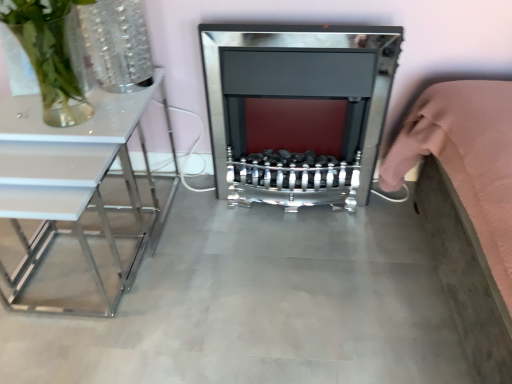
The image size is (512, 384). Describe the element at coordinates (259, 305) in the screenshot. I see `concretesmoothfloor at center` at that location.

Consider the image. In order to face concretesmoothfloor at center, should I rotate leftwards or rightwards?

To align with it, rotate left about 7.653°.

This screenshot has width=512, height=384. What do you see at coordinates (72, 182) in the screenshot? I see `white glossy table at left` at bounding box center [72, 182].

Measure the distance between clear glass vase at upper left and camera.

clear glass vase at upper left is 1.05 meters from camera.

Measure the distance between pink fabric bed at right and camera.

pink fabric bed at right and camera are 71.92 centimeters apart.

Locate an element on the screen. The width and height of the screenshot is (512, 384). pink fabric bed at right is located at coordinates (466, 159).

This screenshot has height=384, width=512. Identify the location of concretesmoothfloor at center. (259, 305).

Based on the photo, between white glossy table at left and clear glass vase at upper left, which one appears on the left side from the viewer's perspective?

white glossy table at left is more to the left.

Does white glossy table at left turn towards clear glass vase at upper left?

No, white glossy table at left is not oriented towards clear glass vase at upper left.

From their relative heights in the image, would you say white glossy table at left is taller or shorter than clear glass vase at upper left?

white glossy table at left is taller than clear glass vase at upper left.

At what (x,y) coordinates should I click in order to perform the action: click on table that appears below the clear glass vase at upper left (from a real-world perspective). Please return your answer as a coordinate pair (x, y). Looking at the image, I should click on pos(72,182).

Do you think pink fabric bed at right is within polished chrome fireplace at center, or outside of it?

pink fabric bed at right is outside polished chrome fireplace at center.

Based on the photo, considering the sizes of objects pink fabric bed at right and polished chrome fireplace at center in the image provided, who is bigger, pink fabric bed at right or polished chrome fireplace at center?

pink fabric bed at right.

The image size is (512, 384). Identify the location of bed that appears below the polished chrome fireplace at center (from the image's perspective). (466, 159).

From the picture: From a real-world perspective, is polished chrome fireplace at center above or below clear glass vase at upper left?

Clearly, from a real-world perspective, polished chrome fireplace at center is below clear glass vase at upper left.

Is polished chrome fireplace at center taller than clear glass vase at upper left?

Correct, polished chrome fireplace at center is much taller as clear glass vase at upper left.

Measure the distance from polished chrome fireplace at center to clear glass vase at upper left.

They are 16.02 inches apart.

Is polished chrome fireplace at center placed right next to clear glass vase at upper left?

polished chrome fireplace at center and clear glass vase at upper left are clearly separated.

Is pink fabric bed at right positioned with its back to white glossy table at left?

No, white glossy table at left is not at the back of pink fabric bed at right.

Is pink fabric bed at right at the left side of white glossy table at left?

In fact, pink fabric bed at right is to the right of white glossy table at left.

From the image's perspective, who appears lower, pink fabric bed at right or white glossy table at left?

pink fabric bed at right, from the image's perspective.

Is the depth of pink fabric bed at right greater than that of white glossy table at left?

No.

Is pink fabric bed at right at the back of white glossy table at left?

white glossy table at left is not turned away from pink fabric bed at right.

Can you confirm if white glossy table at left is positioned to the left of pink fabric bed at right?

Indeed, white glossy table at left is positioned on the left side of pink fabric bed at right.

Locate an element on the screen. Image resolution: width=512 pixels, height=384 pixels. table behind the pink fabric bed at right is located at coordinates (72, 182).

Is point (26, 239) positioned in front of point (494, 107)?

No, (26, 239) is further to viewer.

In the scene shown: Is white glossy table at left facing towards concretesmoothfloor at center?

No, white glossy table at left is not turned towards concretesmoothfloor at center.

Is white glossy table at left further to camera compared to concretesmoothfloor at center?

No, it is not.

Is white glossy table at left smaller than concretesmoothfloor at center?

No.

Does white glossy table at left have a lesser width compared to concretesmoothfloor at center?

Yes.

Looking at this image, from a real-world perspective, which is physically above, polished chrome fireplace at center or white glossy table at left?

polished chrome fireplace at center is physically above.

In the scene shown: Considering the positions of objects polished chrome fireplace at center and white glossy table at left in the image provided, who is more to the left, polished chrome fireplace at center or white glossy table at left?

white glossy table at left is more to the left.

Is polished chrome fireplace at center facing away from white glossy table at left?

polished chrome fireplace at center is not turned away from white glossy table at left.

Looking at this image, does polished chrome fireplace at center have a greater height compared to white glossy table at left?

Correct, polished chrome fireplace at center is much taller as white glossy table at left.

At what (x,y) coordinates should I click in order to perform the action: click on table below the clear glass vase at upper left (from a real-world perspective). Please return your answer as a coordinate pair (x, y). This screenshot has width=512, height=384. Looking at the image, I should click on (72, 182).

You are a GUI agent. You are given a task and a screenshot of the screen. Output one action in this format:
    pyautogui.click(x=<x>, y=<y>)
    Task: Click on the fireplace that appears above the pink fabric bed at right (from the image's perspective)
    The height and width of the screenshot is (384, 512).
    Given the screenshot: What is the action you would take?
    pyautogui.click(x=297, y=110)

Based on their spatial positions, is white glossy table at left or concretesmoothfloor at center closer to polished chrome fireplace at center?

Among the two, concretesmoothfloor at center is located nearer to polished chrome fireplace at center.

Looking at the image, which one is located further to white glossy table at left, clear glass vase at upper left or pink fabric bed at right?

The object further to white glossy table at left is pink fabric bed at right.

Based on their spatial positions, is white glossy table at left or concretesmoothfloor at center further from pink fabric bed at right?

white glossy table at left.

Considering their positions, is clear glass vase at upper left positioned further to polished chrome fireplace at center than white glossy table at left?

Based on the image, white glossy table at left appears to be further to polished chrome fireplace at center.

From the image, which object appears to be farther from pink fabric bed at right, polished chrome fireplace at center or white glossy table at left?

The object further to pink fabric bed at right is white glossy table at left.

When comparing their distances from white glossy table at left, does pink fabric bed at right or polished chrome fireplace at center seem further?

Based on the image, pink fabric bed at right appears to be further to white glossy table at left.

Looking at the image, which one is located closer to pink fabric bed at right, polished chrome fireplace at center or concretesmoothfloor at center?

Based on the image, polished chrome fireplace at center appears to be nearer to pink fabric bed at right.

Based on their spatial positions, is clear glass vase at upper left or concretesmoothfloor at center further from pink fabric bed at right?

clear glass vase at upper left is further to pink fabric bed at right.

Identify the location of concrete located between white glossy table at left and pink fabric bed at right in the left-right direction. This screenshot has width=512, height=384. (259, 305).

Where is `fireplace that lies between clear glass vase at upper left and concretesmoothfloor at center from top to bottom`? The image size is (512, 384). fireplace that lies between clear glass vase at upper left and concretesmoothfloor at center from top to bottom is located at coordinates (297, 110).

At what (x,y) coordinates should I click in order to perform the action: click on table between clear glass vase at upper left and concretesmoothfloor at center in the up-down direction. Please return your answer as a coordinate pair (x, y). The width and height of the screenshot is (512, 384). Looking at the image, I should click on (72, 182).

Identify the location of fireplace located between clear glass vase at upper left and pink fabric bed at right in the left-right direction. The image size is (512, 384). (297, 110).